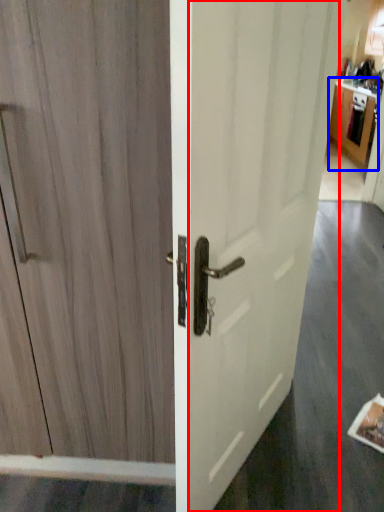
Question: Which object is further to the camera taking this photo, screen door (highlighted by a red box) or cabinetry (highlighted by a blue box)?

Choices:
 (A) screen door
 (B) cabinetry

Answer: (B)